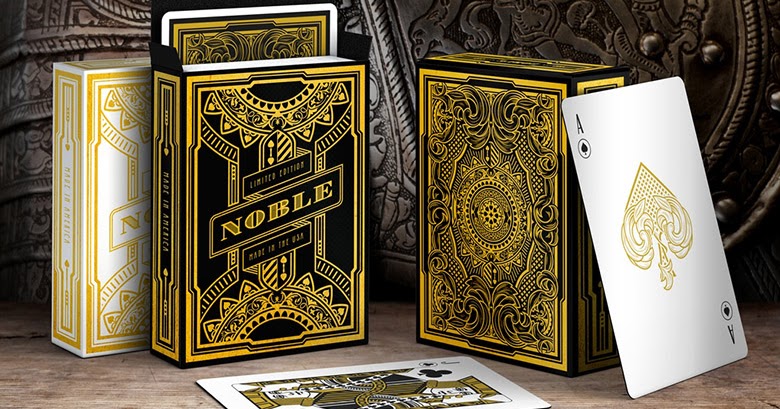
Find the location of a particular element. box is located at coordinates (100, 84), (190, 83), (429, 78).